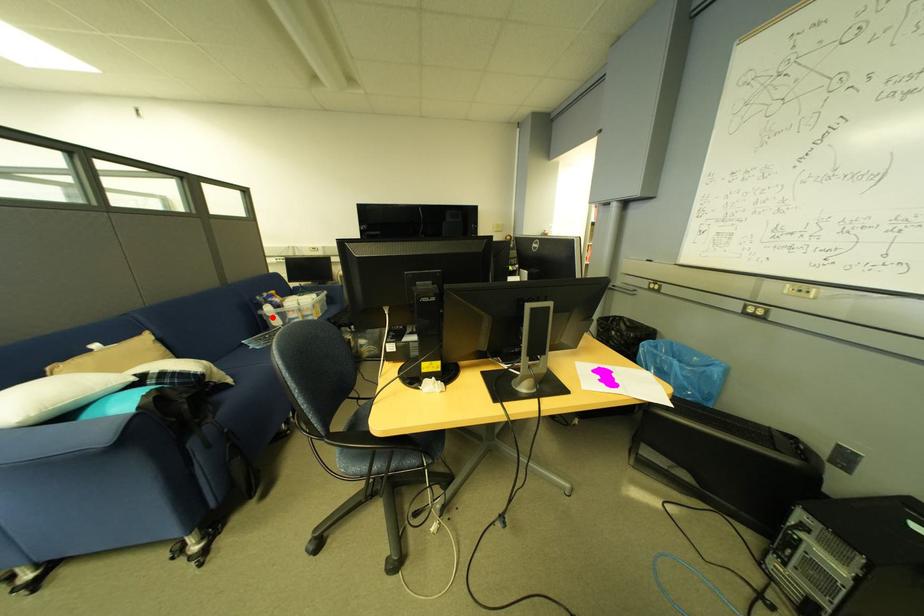
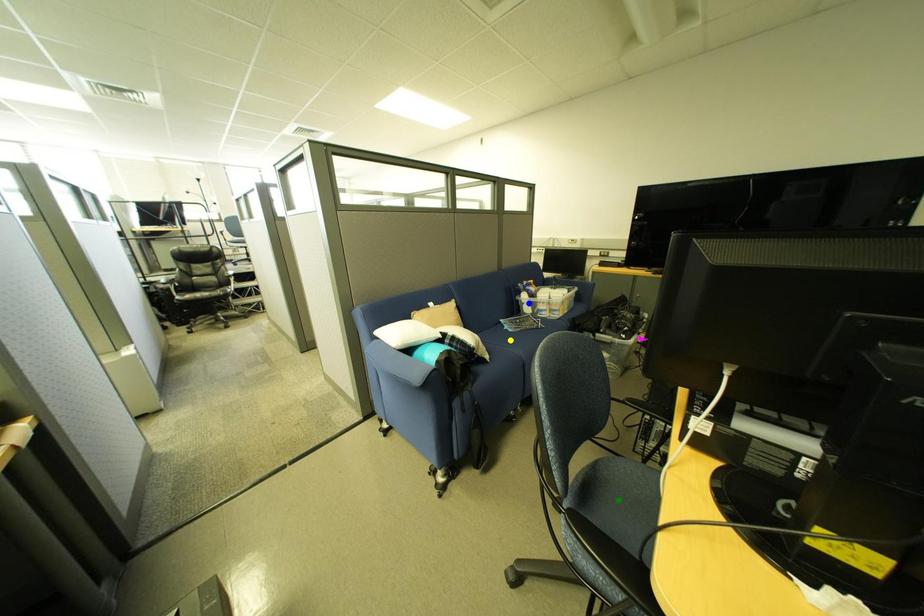
Question: I am providing you with two images of the same scene from different viewpoints. A red point is marked on the first image. You are given multiple points on the second image. In image 2, which mark is for the same physical point as the one in image 1?

Choices:
 (A) green point
 (B) yellow point
 (C) blue point

Answer: (C)